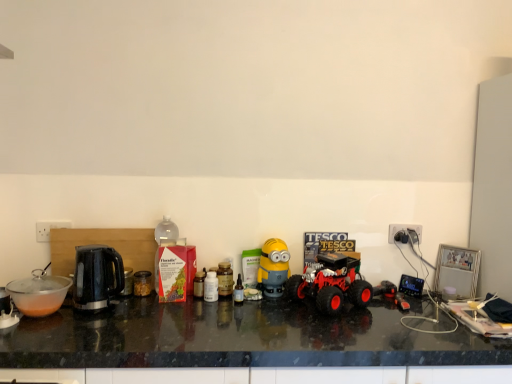
Question: Which direction should I rotate to look at translucent plastic bottle at center, which ranks as the 2th bottle in left-to-right order, — up or down?

Choices:
 (A) down
 (B) up

Answer: (A)

Question: From the image's perspective, is translucent plastic bottle at center, which is the second bottle in right-to-left order, located beneath transparent plastic bowl at left?

Choices:
 (A) no
 (B) yes

Answer: (A)

Question: Can you confirm if translucent plastic bottle at center, which ranks as the 2th bottle in left-to-right order, is wider than transparent plastic bowl at left?

Choices:
 (A) yes
 (B) no

Answer: (B)

Question: Is translucent plastic bottle at center, which ranks as the 2th bottle in left-to-right order, closer to the viewer compared to transparent plastic bowl at left?

Choices:
 (A) no
 (B) yes

Answer: (A)

Question: Is translucent plastic bottle at center, which ranks as the 2th bottle in left-to-right order, far from transparent plastic bowl at left?

Choices:
 (A) no
 (B) yes

Answer: (A)

Question: Is translucent plastic bottle at center, which is the second bottle in right-to-left order, in contact with transparent plastic bowl at left?

Choices:
 (A) no
 (B) yes

Answer: (A)

Question: Would you say translucent plastic bottle at center, which is the second bottle in right-to-left order, is outside transparent plastic bowl at left?

Choices:
 (A) yes
 (B) no

Answer: (A)

Question: From the image's perspective, is translucent plastic bottle at center, which ranks as the 2th bottle in left-to-right order, located above black plastic kettle at left?

Choices:
 (A) no
 (B) yes

Answer: (A)

Question: Is translucent plastic bottle at center, which ranks as the 2th bottle in left-to-right order, wider than black plastic kettle at left?

Choices:
 (A) yes
 (B) no

Answer: (B)

Question: Considering the relative sizes of translucent plastic bottle at center, which ranks as the 2th bottle in left-to-right order, and black plastic kettle at left in the image provided, is translucent plastic bottle at center, which ranks as the 2th bottle in left-to-right order, taller than black plastic kettle at left?

Choices:
 (A) yes
 (B) no

Answer: (B)

Question: Considering the relative positions of translucent plastic bottle at center, which ranks as the 2th bottle in left-to-right order, and black plastic kettle at left in the image provided, is translucent plastic bottle at center, which ranks as the 2th bottle in left-to-right order, behind black plastic kettle at left?

Choices:
 (A) yes
 (B) no

Answer: (A)

Question: Is translucent plastic bottle at center, which is the second bottle in right-to-left order, to the left of black plastic kettle at left from the viewer's perspective?

Choices:
 (A) no
 (B) yes

Answer: (A)

Question: Is the surface of translucent plastic bottle at center, which ranks as the 2th bottle in left-to-right order, in direct contact with black plastic kettle at left?

Choices:
 (A) yes
 (B) no

Answer: (B)

Question: Is translucent plastic bottle at center, arranged as the 3th bottle when viewed from the left, turned away from yellow matte minion at center, acting as the 1th toy starting from the left?

Choices:
 (A) no
 (B) yes

Answer: (A)